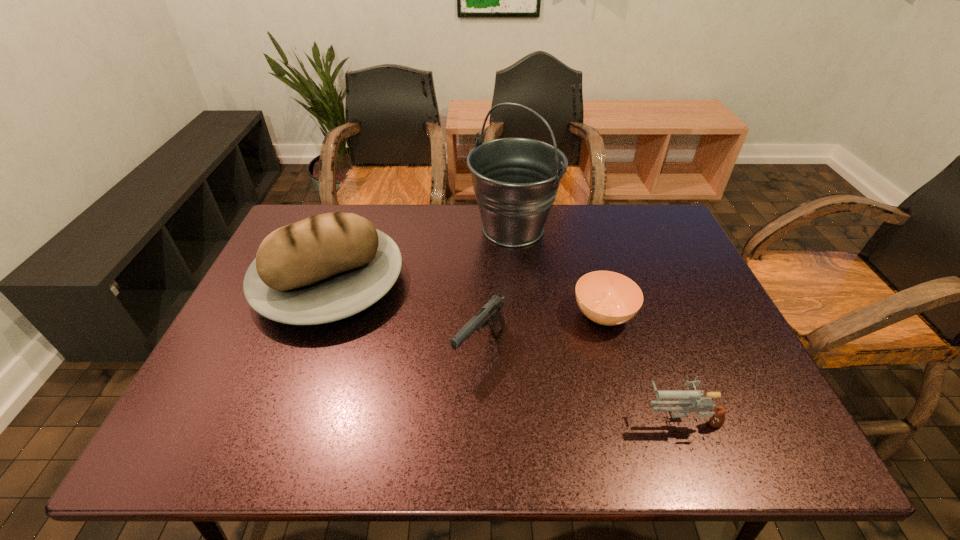
The width and height of the screenshot is (960, 540). What are the coordinates of `object that is at the near right corner` in the screenshot? It's located at (686, 398).

I want to click on vacant space at the far edge of the desktop, so click(611, 236).

Locate an element on the screen. free space at the near edge is located at coordinates (607, 459).

In the image, there is a desktop. Identify the location of blank space at the left edge. (260, 377).

Where is `free space at the right edge`? This screenshot has height=540, width=960. free space at the right edge is located at coordinates (661, 258).

Locate an element on the screen. vacant position at the near left corner of the desktop is located at coordinates (237, 420).

In the image, there is a desktop. Identify the location of vacant space at the far right corner. This screenshot has width=960, height=540. (649, 235).

Locate an element on the screen. vacant space at the near right corner of the desktop is located at coordinates (731, 454).

You are a GUI agent. You are given a task and a screenshot of the screen. Output one action in this format:
    pyautogui.click(x=<x>, y=<y>)
    Task: Click on the vacant area between the farther gun and the bucket
    The image size is (960, 540).
    Given the screenshot: What is the action you would take?
    pyautogui.click(x=496, y=288)

Locate an element on the screen. vacant area that lies between the farther gun and the soup bowl is located at coordinates (541, 331).